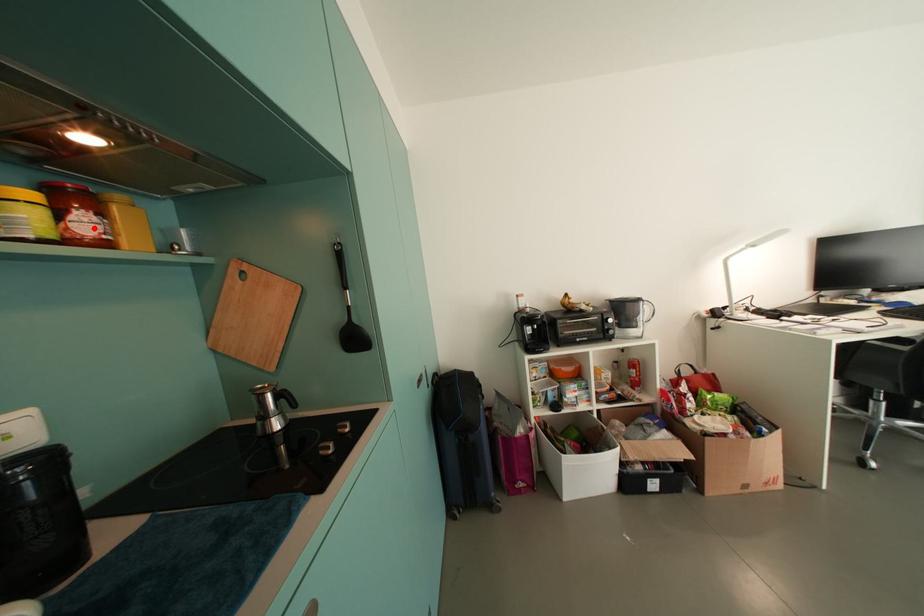
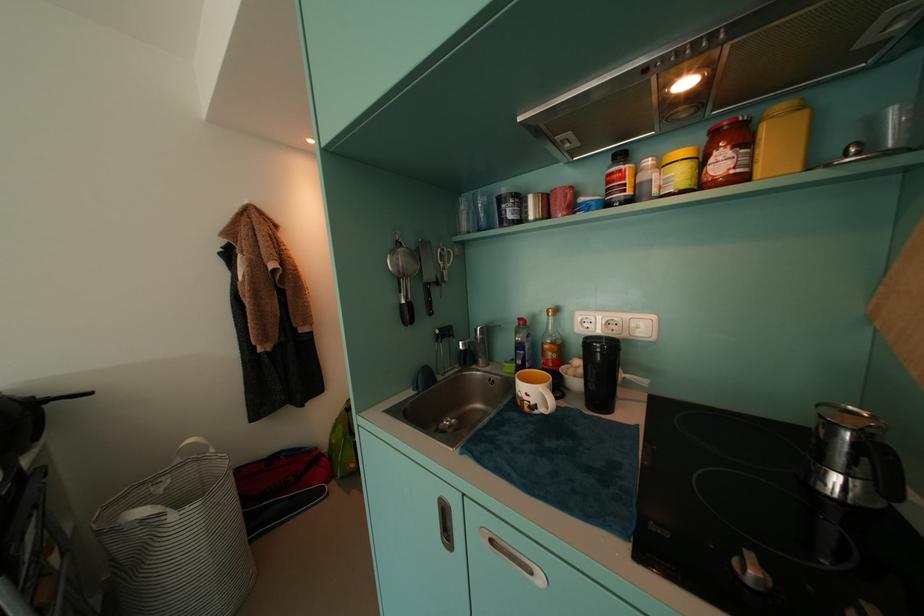
Where in the second image is the point corresponding to the highlighted location from the first image?

(730, 166)